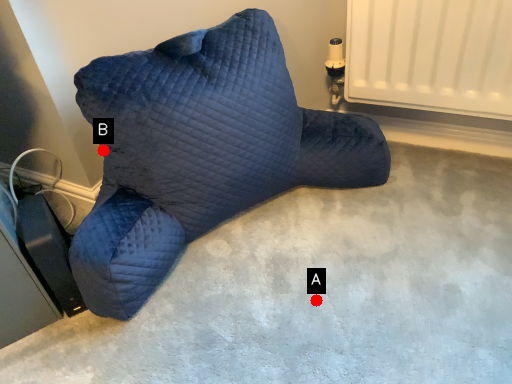
Question: Two points are circled on the image, labeled by A and B beside each circle. Which point appears farthest from the camera in this image?

Choices:
 (A) A is further
 (B) B is further

Answer: (B)